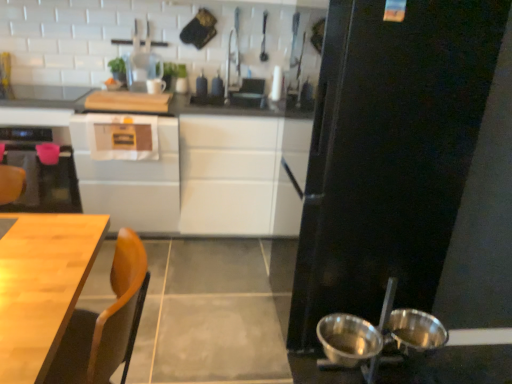
Question: From a real-world perspective, is white glossy cabinet at center, which is the 2th cabinetry in right-to-left order, above or below white glossy cabinet at center, positioned as the second cabinetry in left-to-right order?

Choices:
 (A) below
 (B) above

Answer: (A)

Question: From their relative heights in the image, would you say white glossy cabinet at center, placed as the first cabinetry when sorted from left to right, is taller or shorter than white glossy cabinet at center, positioned as the second cabinetry in left-to-right order?

Choices:
 (A) tall
 (B) short

Answer: (B)

Question: Estimate the real-world distances between objects in this image. Which object is closer to the white glossy cabinet at center, which is the 2th cabinetry in right-to-left order?

Choices:
 (A) black matte refrigerator at right
 (B) white glossy cabinet at center, positioned as the second cabinetry in left-to-right order
 (C) metallic silver bowl at lower right, which appears as the 1th bowl when viewed from the left
 (D) shiny metallic bowls at lower right, the first bowl in the right-to-left sequence
 (E) white glossy countertop at upper left

Answer: (B)

Question: Which is nearer to the wooden table at lower left?

Choices:
 (A) shiny metallic bowls at lower right, the first bowl in the right-to-left sequence
 (B) metallic silver bowl at lower right, the second bowl when ordered from right to left
 (C) black matte refrigerator at right
 (D) white glossy countertop at upper left
 (E) white glossy cabinet at center, positioned as the second cabinetry in left-to-right order

Answer: (B)